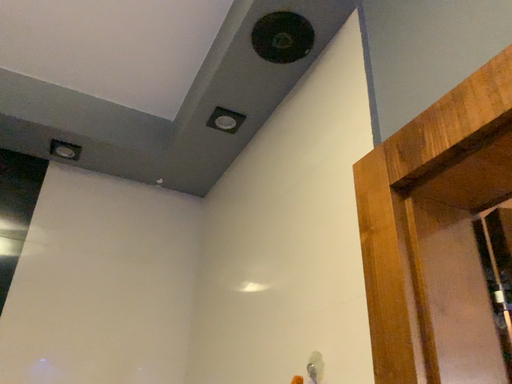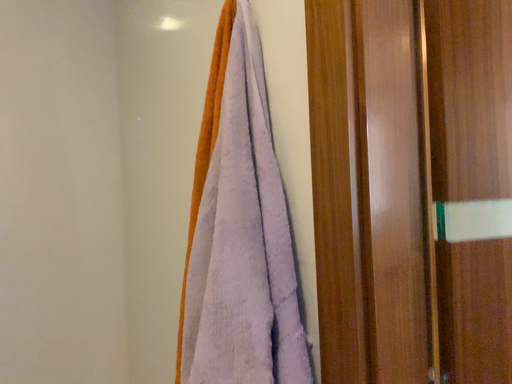
Question: How did the camera likely rotate when shooting the video?

Choices:
 (A) rotated left
 (B) rotated right

Answer: (B)